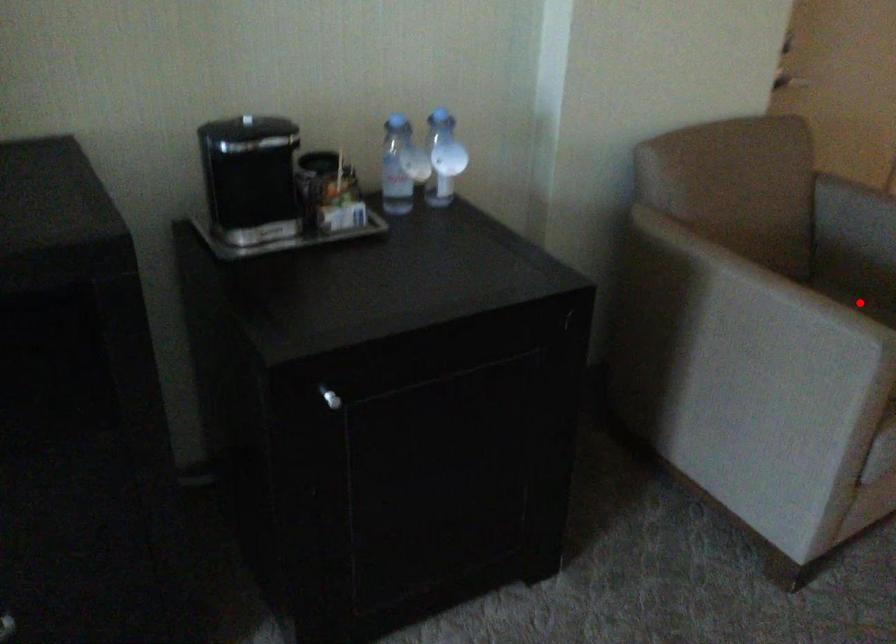
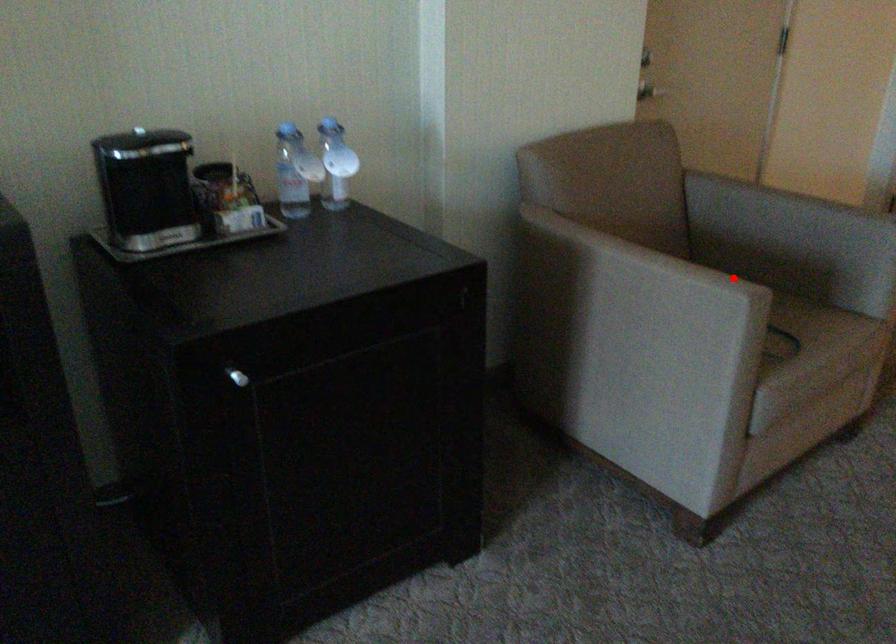
I am providing you with two images of the same scene from different viewpoints. A red point is marked on the first image and another point is marked on the second image. Is the marked point in image1 the same physical position as the marked point in image2?

Yes